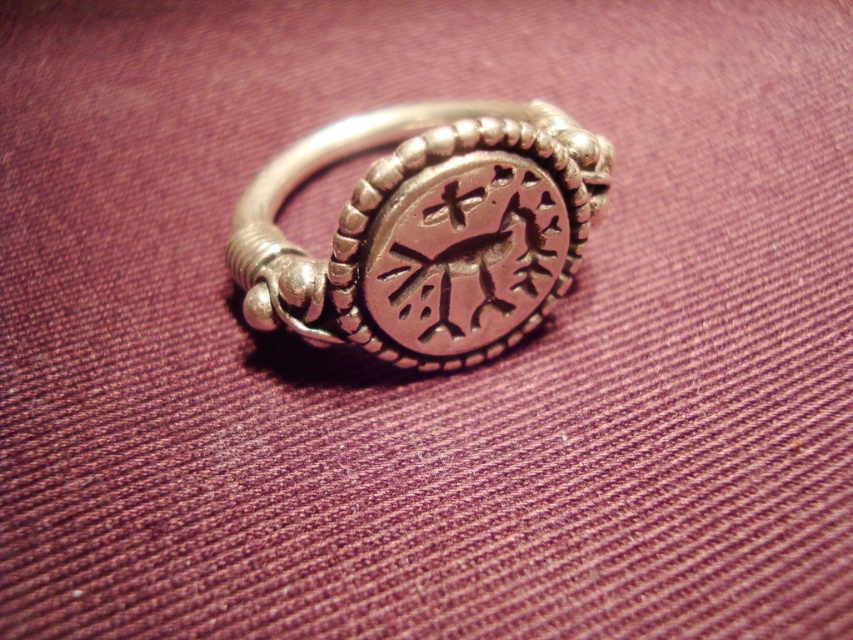
You are examining a metallic ring from above. There are two points marked on the ring, point 1 at position (451, 145) and point 2 at (497, 177). Which point is closer to your viewpoint?

Point 1 at position (451, 145) is closer to the camera than point 2 at (497, 177).

You are a jeweler examining a ring and a stone. The polished silver ring at center has a decorative band with evenly spaced beads. The dark brown textured stone at center has a natural, uneven surface. Which object has a surface that is more uniform in texture?

The polished silver ring at center has a surface that is more uniform in texture because it is described as having a decorative band with evenly spaced beads, while the dark brown textured stone at center has a natural, uneven surface.

You are a jeweler who needs to place a protective cover over both the polished silver ring at center and the dark brown textured stone at center. The cover can only extend 2 inches from the center. Will the cover be able to fully enclose both objects?

The distance between the polished silver ring at center and the dark brown textured stone at center is 2.33 inches. Since the cover can only extend 2 inches from the center, it will not be able to fully enclose both objects as the distance exceeds the cover radius.